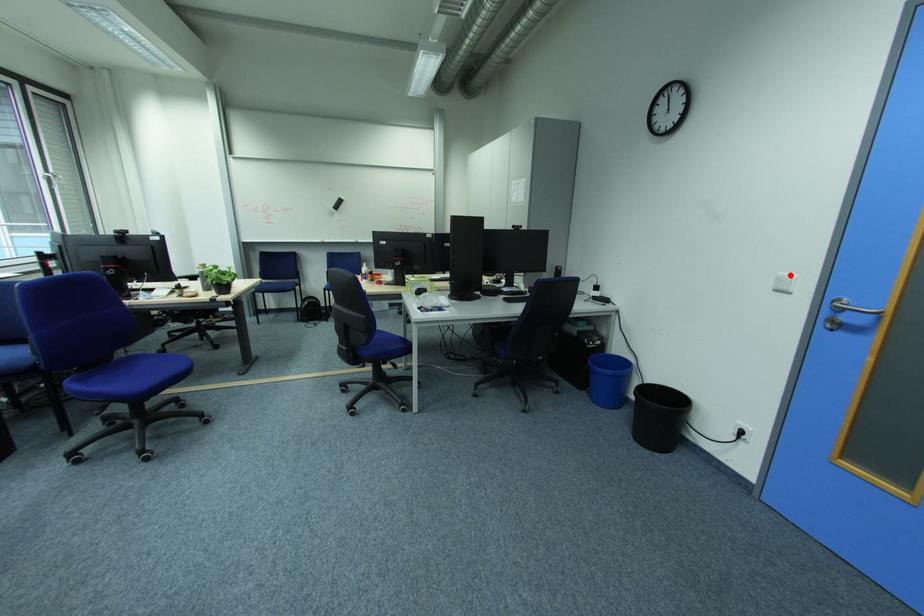
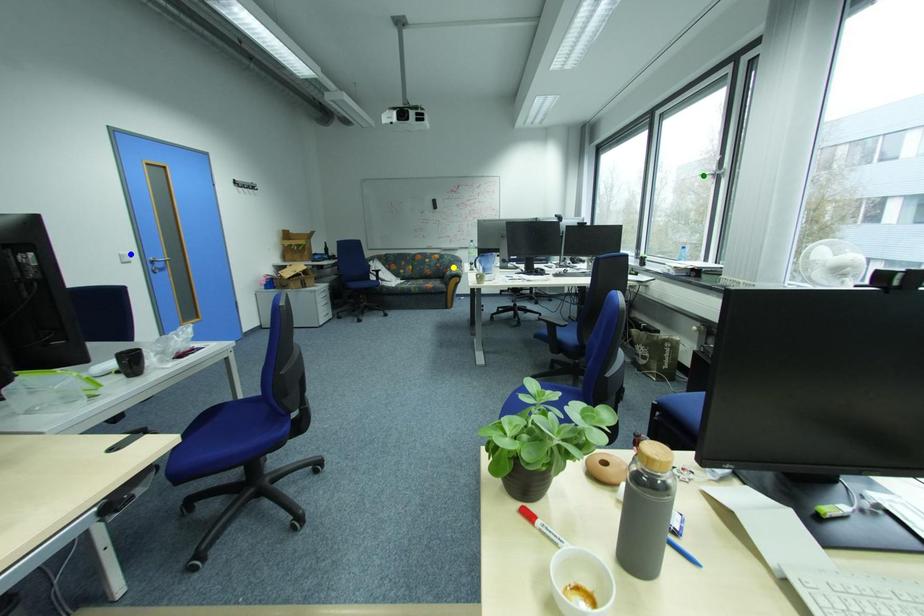
Question: I am providing you with two images of the same scene from different viewpoints. A red point is marked on the first image. You are given multiple points on the second image. Which spot in image 2 lines up with the point in image 1?

Choices:
 (A) blue point
 (B) green point
 (C) yellow point

Answer: (A)